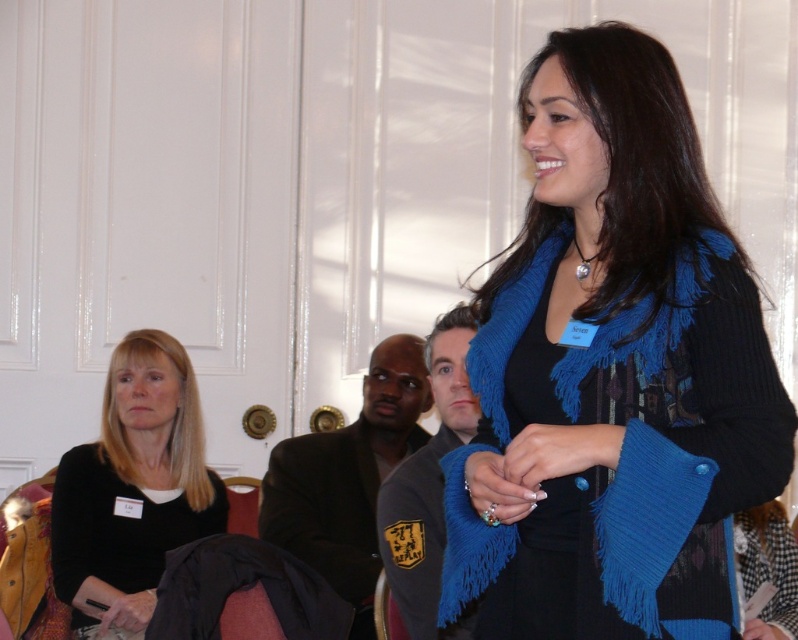
Is point (714, 257) closer to camera compared to point (160, 474)?

Yes.

Consider the image. Can you confirm if blue knitted scarf at center is smaller than black matte jacket at left?

Actually, blue knitted scarf at center might be larger than black matte jacket at left.

You are a GUI agent. You are given a task and a screenshot of the screen. Output one action in this format:
    pyautogui.click(x=<x>, y=<y>)
    Task: Click on the blue knitted scarf at center
    
    Given the screenshot: What is the action you would take?
    pyautogui.click(x=611, y=372)